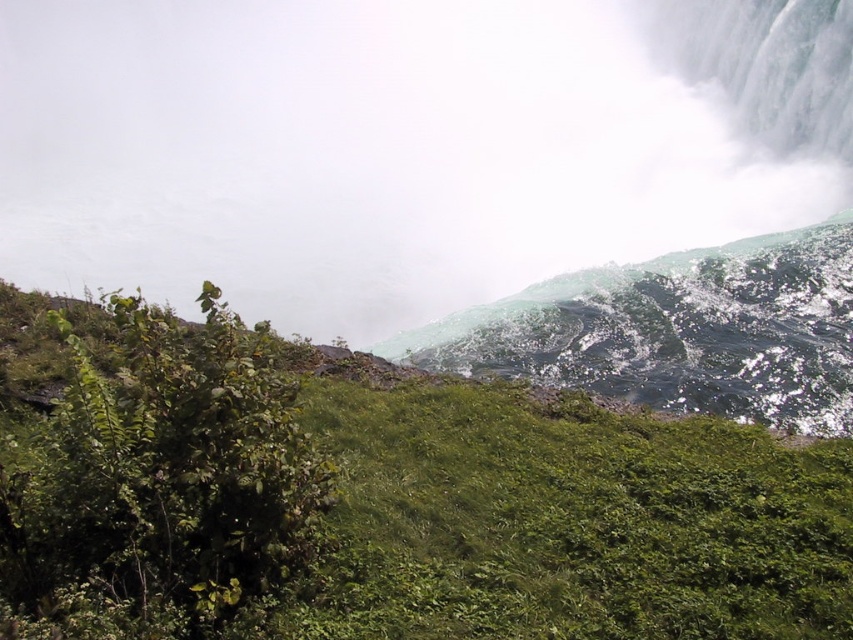
Question: Which of the following is the farthest from the observer?

Choices:
 (A) green grassy hillside at center
 (B) white misty fog at upper center

Answer: (B)

Question: Is green grassy hillside at center below white misty fog at upper center?

Choices:
 (A) no
 (B) yes

Answer: (B)

Question: Can you confirm if green grassy hillside at center is bigger than white misty fog at upper center?

Choices:
 (A) no
 (B) yes

Answer: (A)

Question: Is green grassy hillside at center smaller than white misty fog at upper center?

Choices:
 (A) yes
 (B) no

Answer: (A)

Question: Which of the following is the farthest from the observer?

Choices:
 (A) (712, 428)
 (B) (39, 88)

Answer: (B)